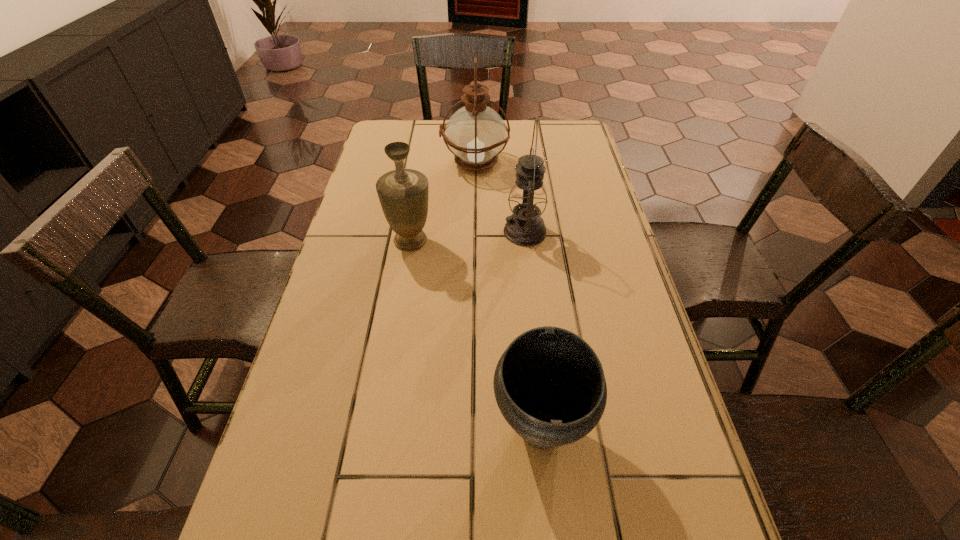
This screenshot has width=960, height=540. I want to click on the farthest object, so click(x=475, y=134).

Where is `the nearer oil lamp`? The image size is (960, 540). the nearer oil lamp is located at coordinates (525, 227).

Find the location of a particular element. This screenshot has width=960, height=540. the left urn is located at coordinates (403, 193).

I want to click on the farther urn, so click(403, 193).

The image size is (960, 540). I want to click on the shortest object, so click(550, 374).

Identify the location of the nearer urn. The height and width of the screenshot is (540, 960). (550, 374).

This screenshot has height=540, width=960. I want to click on vacant area situated 0.240m on the left of the farther oil lamp, so click(369, 163).

Locate an element on the screen. This screenshot has height=540, width=960. vacant space located 0.180m on the right of the nearer oil lamp is located at coordinates (612, 232).

The width and height of the screenshot is (960, 540). I want to click on vacant space situated on the front of the second shortest object, so 403,285.

This screenshot has height=540, width=960. In order to click on vacant space located 0.150m on the left of the right urn in this screenshot , I will do `click(412, 430)`.